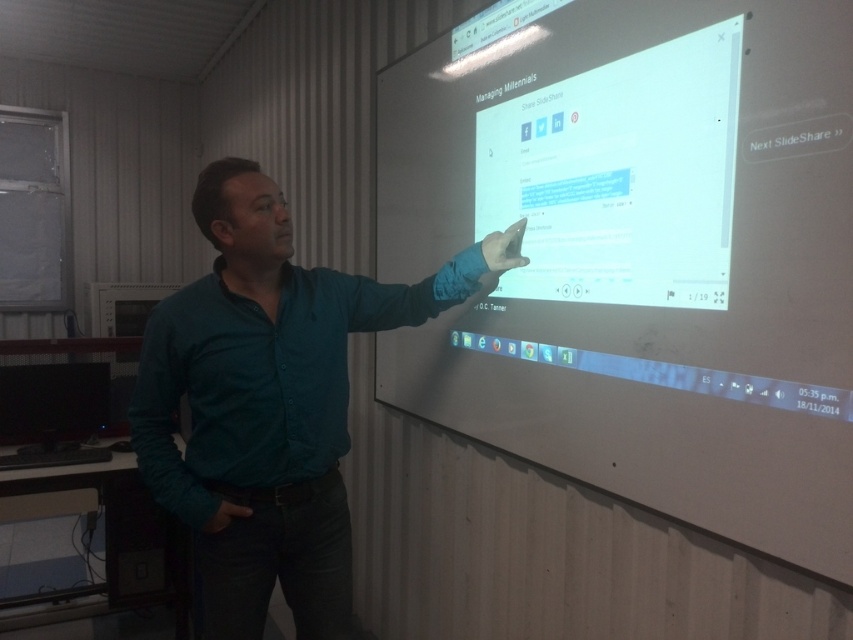
You are an event planner setting up a presentation room. The room has a white matte projection screen at center and a teal shirt at center. Which object is bigger in the scene?

The white matte projection screen at center is larger than the teal shirt at center.

You are a presenter standing in front of the white matte projection screen at center and the teal shirt at center. You want to ensure that your audience can clearly see both the screen and your presentation notes. If your eyes are 5 feet above the floor, and the screen and shirt are at the same height, which object is closer to your eyes?

The teal shirt at center is closer to your eyes because it is part of your own clothing and positioned at the same height as the screen, but the distance between them is 21.58 inches. Since the shirt is on your body, it would naturally be closer than the screen which is mounted on the wall ahead.

You are attending a presentation and see the man pointing at two points on the projection screen. The points are labeled as point 1 at coordinates (787, 524) and point 2 at (287, 528). Based on their positions, which point is closer to you?

Point 1 at coordinates (787, 524) is closer to the viewer than point 2 at (287, 528) because the Objects Description states that point 1 is closer.